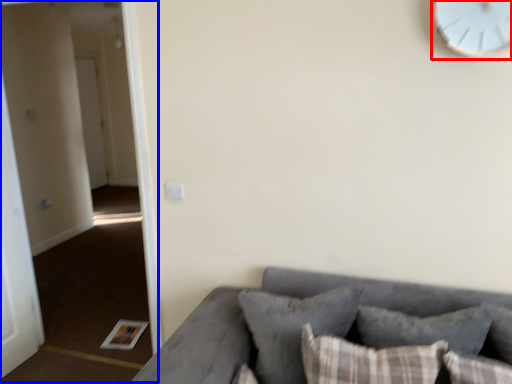
Question: Which object is further to the camera taking this photo, clock (highlighted by a red box) or corridor (highlighted by a blue box)?

Choices:
 (A) clock
 (B) corridor

Answer: (B)